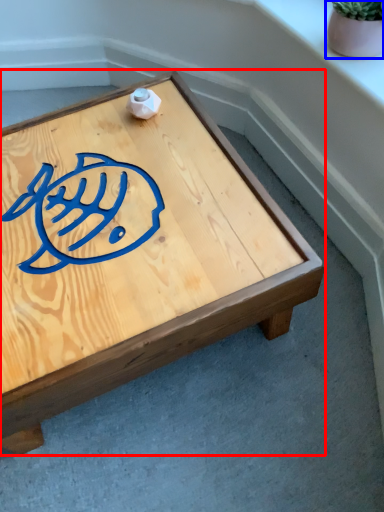
Question: Which object is further to the camera taking this photo, coffee table (highlighted by a red box) or flowerpot (highlighted by a blue box)?

Choices:
 (A) coffee table
 (B) flowerpot

Answer: (B)